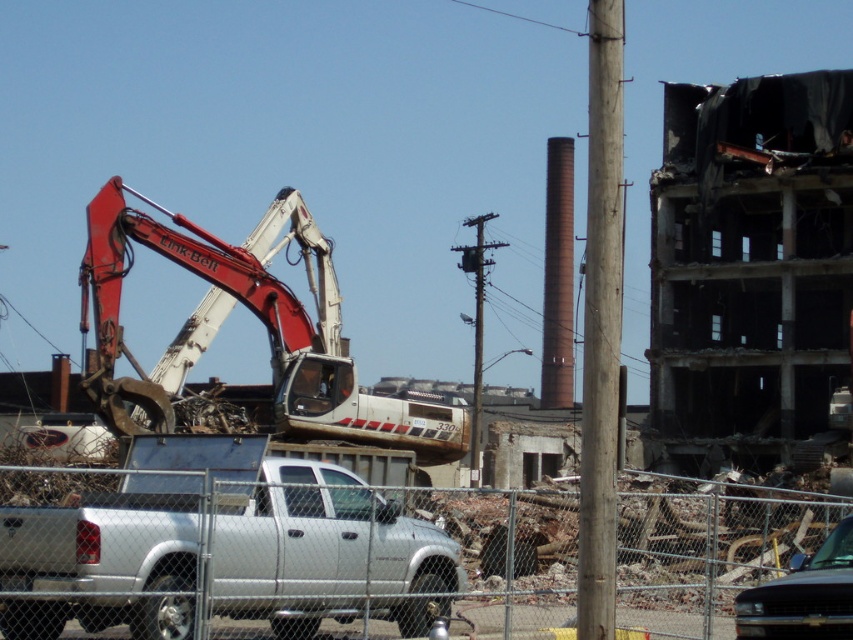
Question: Which of the following is the closest to the observer?

Choices:
 (A) (229, 568)
 (B) (836, 525)

Answer: (A)

Question: Which point is farther to the camera?

Choices:
 (A) matte white excavator at left
 (B) silver metallic truck at center

Answer: (A)

Question: Is silver metallic truck at center above shiny black car at lower right?

Choices:
 (A) no
 (B) yes

Answer: (B)

Question: Does matte white excavator at left have a larger size compared to wooden pole at center-right?

Choices:
 (A) no
 (B) yes

Answer: (A)

Question: Is matte white excavator at left thinner than wooden pole at center-right?

Choices:
 (A) no
 (B) yes

Answer: (A)

Question: Which point is farther from the camera taking this photo?

Choices:
 (A) (614, 236)
 (B) (311, 605)

Answer: (B)